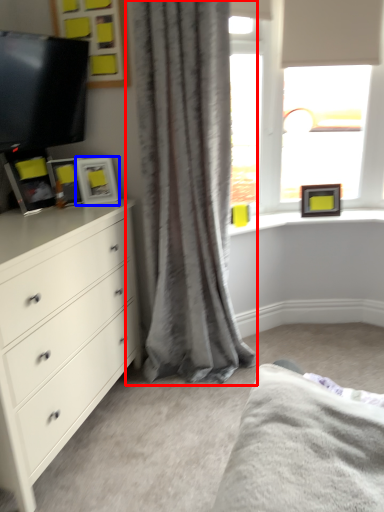
Question: Which point is further to the camera, curtain (highlighted by a red box) or picture frame (highlighted by a blue box)?

Choices:
 (A) curtain
 (B) picture frame

Answer: (B)